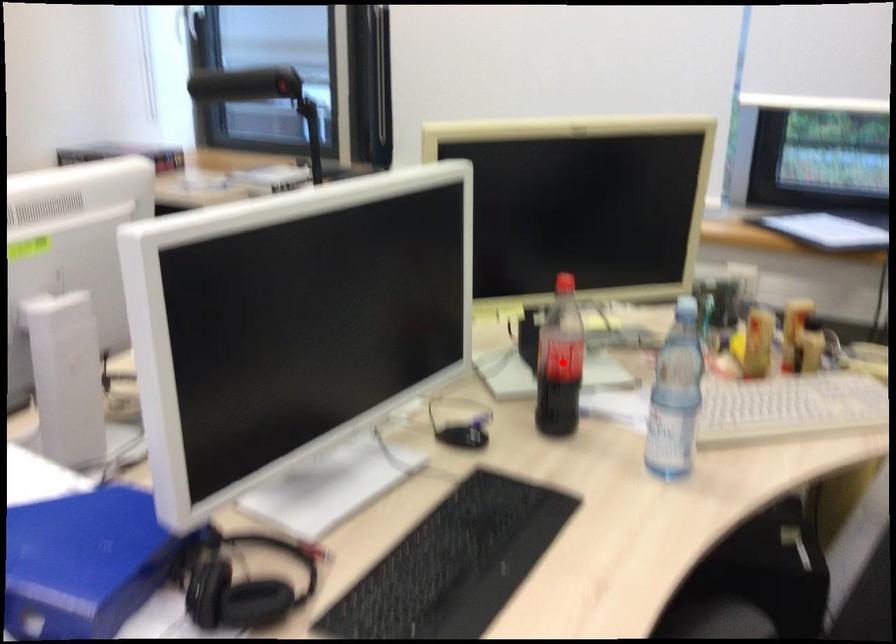
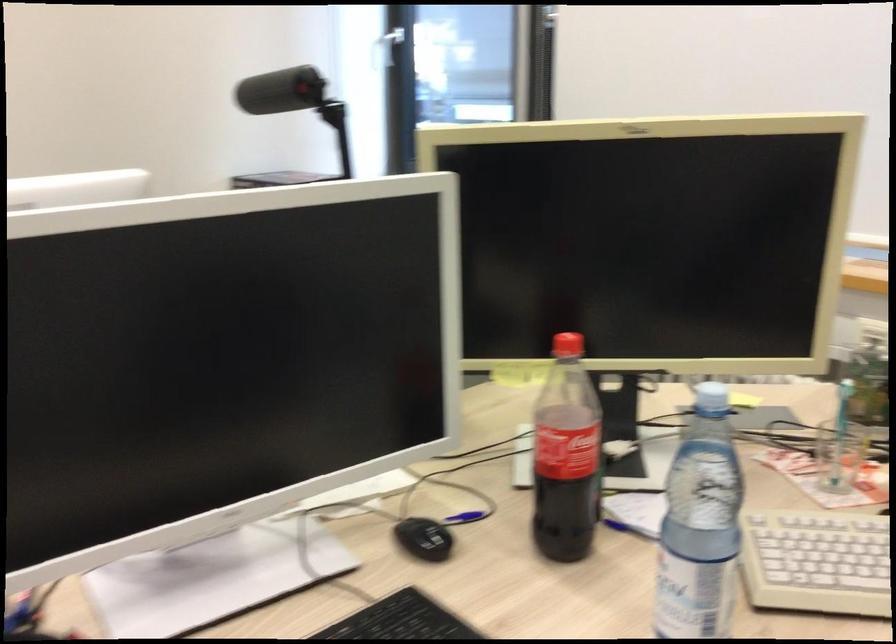
Question: A red point is marked in image1. In image2, is the corresponding 3D point closer to the camera or farther? Reply with the corresponding letter.

Choices:
 (A) The corresponding 3D point is closer.
 (B) The corresponding 3D point is farther.

Answer: (A)